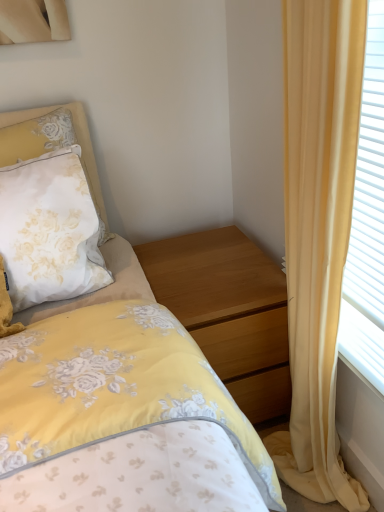
Locate an element on the screen. The image size is (384, 512). wooden nightstand at center is located at coordinates tap(228, 311).

This screenshot has width=384, height=512. Describe the element at coordinates (318, 232) in the screenshot. I see `yellow fabric curtain at right` at that location.

Where is `white satin pillow at upper left`? The image size is (384, 512). white satin pillow at upper left is located at coordinates (52, 143).

The width and height of the screenshot is (384, 512). I want to click on wooden nightstand at center, so click(x=228, y=311).

From the image's perspective, between white satin pillow at upper left and yellow fabric curtain at right, who is located below?

yellow fabric curtain at right appears lower in the image.

From a real-world perspective, which is physically below, white satin pillow at upper left or yellow fabric curtain at right?

From a 3D spatial view, yellow fabric curtain at right is below.

Is white satin pillow at upper left oriented towards yellow fabric curtain at right?

No, white satin pillow at upper left is not aimed at yellow fabric curtain at right.

Is white satin pillow at upper left to the left or to the right of yellow fabric curtain at right in the image?

From the image, it's evident that white satin pillow at upper left is to the left of yellow fabric curtain at right.

Image resolution: width=384 pixels, height=512 pixels. Find the location of `nightstand behind the white satin pillow at upper left`. nightstand behind the white satin pillow at upper left is located at coordinates (228, 311).

From a real-world perspective, between wooden nightstand at center and white satin pillow at upper left, who is vertically lower?

wooden nightstand at center, from a real-world perspective.

In the scene shown: Who is shorter, wooden nightstand at center or white satin pillow at upper left?

white satin pillow at upper left.

Considering the positions of point (255, 386) and point (8, 113), is point (255, 386) closer or farther from the camera than point (8, 113)?

Point (255, 386) appears to be farther away from the viewer than point (8, 113).

Is wooden nightstand at center at the back of yellow fabric curtain at right?

yellow fabric curtain at right is not turned away from wooden nightstand at center.

Identify the location of curtain above the wooden nightstand at center (from the image's perspective). (318, 232).

Are yellow fabric curtain at right and wooden nightstand at center located far from each other?

Actually, yellow fabric curtain at right and wooden nightstand at center are a little close together.

Considering the sizes of objects yellow fabric curtain at right and wooden nightstand at center in the image provided, who is taller, yellow fabric curtain at right or wooden nightstand at center?

Standing taller between the two is yellow fabric curtain at right.

Is wooden nightstand at center not near yellow fabric curtain at right?

No, there isn't a large distance between wooden nightstand at center and yellow fabric curtain at right.

Between wooden nightstand at center and yellow fabric curtain at right, which one appears on the left side from the viewer's perspective?

Positioned to the left is wooden nightstand at center.

Is wooden nightstand at center smaller than yellow fabric curtain at right?

Incorrect, wooden nightstand at center is not smaller in size than yellow fabric curtain at right.

Looking at this image, can you confirm if wooden nightstand at center is thinner than yellow fabric curtain at right?

No.

From a real-world perspective, which is physically below, yellow fabric curtain at right or white satin pillow at upper left?

From a 3D spatial view, yellow fabric curtain at right is below.

Can you tell me how much yellow fabric curtain at right and white satin pillow at upper left differ in facing direction?

There is a 87-degree angle between the facing directions of yellow fabric curtain at right and white satin pillow at upper left.

Between yellow fabric curtain at right and white satin pillow at upper left, which one appears on the left side from the viewer's perspective?

From the viewer's perspective, white satin pillow at upper left appears more on the left side.

Is yellow fabric curtain at right not within white satin pillow at upper left?

Yes.

Based on the photo, which is nearer, [55,115] or [210,294]?

Point [55,115] is farther from the camera than point [210,294].

From a real-world perspective, relative to wooden nightstand at center, is white satin pillow at upper left vertically above or below?

From a real-world perspective, white satin pillow at upper left is physically above wooden nightstand at center.

Is white satin pillow at upper left in contact with wooden nightstand at center?

No, white satin pillow at upper left is not with wooden nightstand at center.

Where is `curtain on the right of white satin pillow at upper left`? The width and height of the screenshot is (384, 512). curtain on the right of white satin pillow at upper left is located at coordinates (318, 232).

In the image, there is a white satin pillow at upper left. Where is `nightstand below it (from the image's perspective)`? The image size is (384, 512). nightstand below it (from the image's perspective) is located at coordinates (228, 311).

Based on their spatial positions, is wooden nightstand at center or white satin pillow at upper left closer to yellow fabric curtain at right?

The object closer to yellow fabric curtain at right is wooden nightstand at center.

From the image, which object appears to be farther from wooden nightstand at center, yellow fabric curtain at right or white satin pillow at upper left?

Based on the image, white satin pillow at upper left appears to be further to wooden nightstand at center.

From the image, which object appears to be farther from wooden nightstand at center, white satin pillow at upper left or yellow fabric curtain at right?

The object further to wooden nightstand at center is white satin pillow at upper left.

Based on their spatial positions, is white satin pillow at upper left or wooden nightstand at center further from yellow fabric curtain at right?

white satin pillow at upper left is positioned further to the anchor yellow fabric curtain at right.

Considering their positions, is wooden nightstand at center positioned further to white satin pillow at upper left than yellow fabric curtain at right?

yellow fabric curtain at right is positioned further to the anchor white satin pillow at upper left.

Considering their positions, is yellow fabric curtain at right positioned closer to white satin pillow at upper left than wooden nightstand at center?

wooden nightstand at center is positioned closer to the anchor white satin pillow at upper left.

Find the location of `nightstand located between white satin pillow at upper left and yellow fabric curtain at right in the left-right direction`. nightstand located between white satin pillow at upper left and yellow fabric curtain at right in the left-right direction is located at coordinates (228, 311).